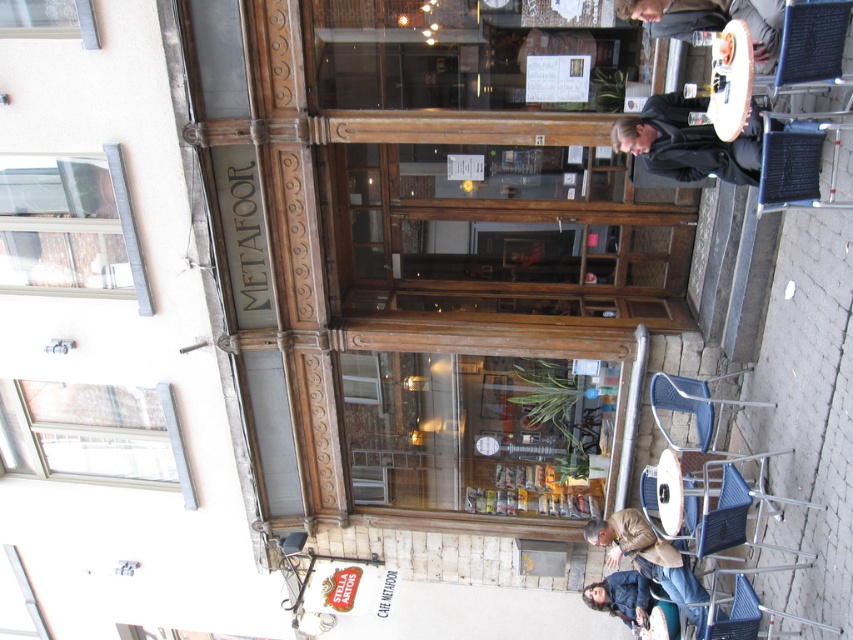
Which of these two, clear glass window at upper left or white plastic window at upper left, stands shorter?

With less height is white plastic window at upper left.

Which is in front, point (16, 269) or point (20, 422)?

Positioned in front is point (16, 269).

Identify the location of clear glass window at upper left. The height and width of the screenshot is (640, 853). (68, 227).

Does leather jacket at lower right appear over dark brown leather jacket at upper right?

Incorrect, leather jacket at lower right is not positioned above dark brown leather jacket at upper right.

Where is `leather jacket at lower right`? The height and width of the screenshot is (640, 853). leather jacket at lower right is located at coordinates (645, 554).

The height and width of the screenshot is (640, 853). What do you see at coordinates (48, 19) in the screenshot? I see `transparent glass window at upper left` at bounding box center [48, 19].

Is point (32, 10) positioned before point (592, 586)?

That is True.

What are the coordinates of `transparent glass window at upper left` in the screenshot? It's located at (48, 19).